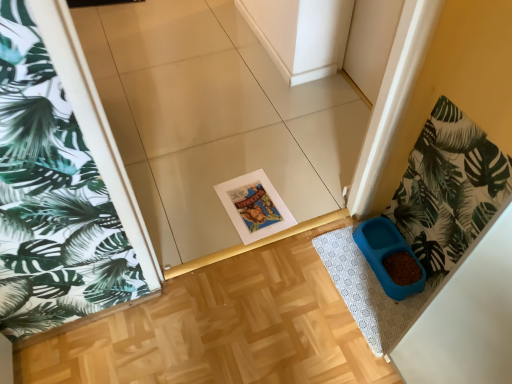
The height and width of the screenshot is (384, 512). What do you see at coordinates (386, 254) in the screenshot? I see `blue plastic pet food bowl at lower right` at bounding box center [386, 254].

Where is `blue plastic pet food bowl at lower right`? blue plastic pet food bowl at lower right is located at coordinates (386, 254).

Measure the distance between blue plastic pet food bowl at lower right and camera.

The depth of blue plastic pet food bowl at lower right is 1.33 meters.

Where is `blue plastic pet food bowl at lower right`? This screenshot has height=384, width=512. blue plastic pet food bowl at lower right is located at coordinates (386, 254).